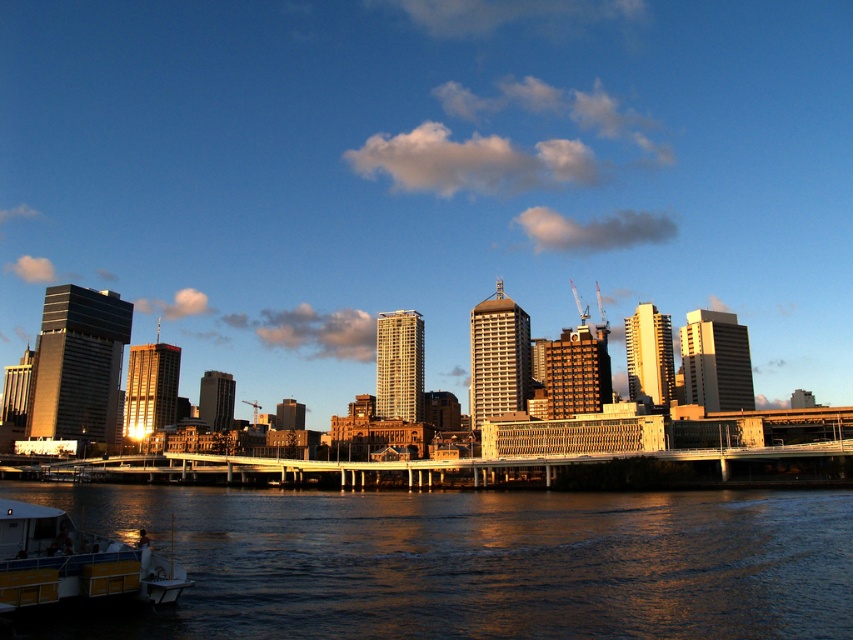
Question: Which point is closer to the camera taking this photo?

Choices:
 (A) (831, 621)
 (B) (74, 563)

Answer: (A)

Question: Which point is farther from the camera taking this photo?

Choices:
 (A) (59, 573)
 (B) (105, 524)

Answer: (B)

Question: Does dark reflective water at lower left have a lesser width compared to yellow plastic boat at lower left?

Choices:
 (A) no
 (B) yes

Answer: (A)

Question: Considering the relative positions of dark reflective water at lower left and yellow plastic boat at lower left in the image provided, where is dark reflective water at lower left located with respect to yellow plastic boat at lower left?

Choices:
 (A) above
 (B) below

Answer: (B)

Question: Does dark reflective water at lower left lie in front of yellow plastic boat at lower left?

Choices:
 (A) yes
 (B) no

Answer: (B)